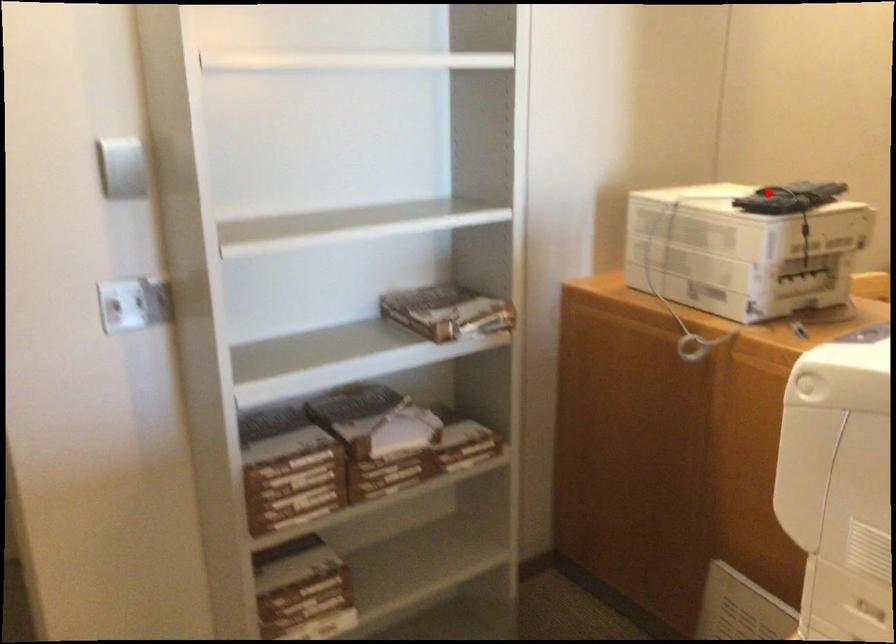
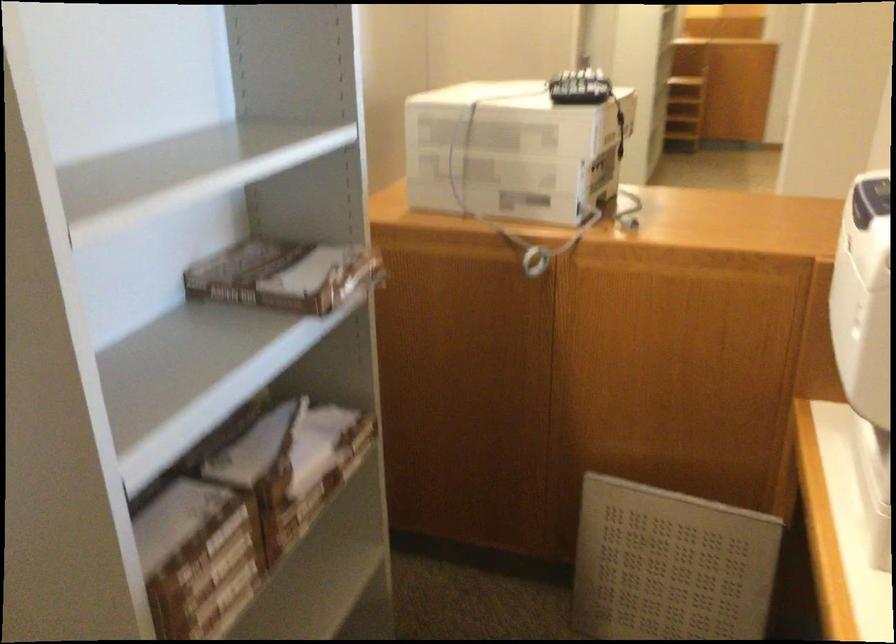
Question: I am providing you with two images of the same scene from different viewpoints. A red point is marked on the first image. Can you still see the location of the red point in image 2?

Choices:
 (A) Yes
 (B) No

Answer: (A)